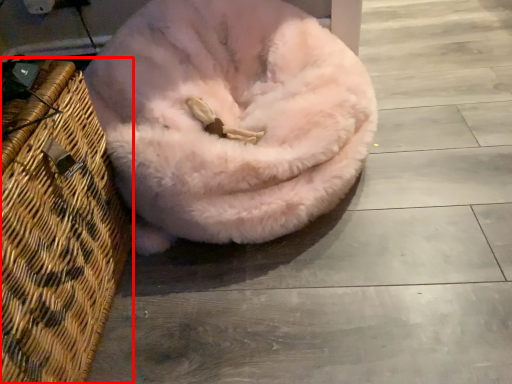
Question: From the image, what is the correct spatial relationship of basket (annotated by the red box) in relation to dog bed?

Choices:
 (A) right
 (B) left

Answer: (B)